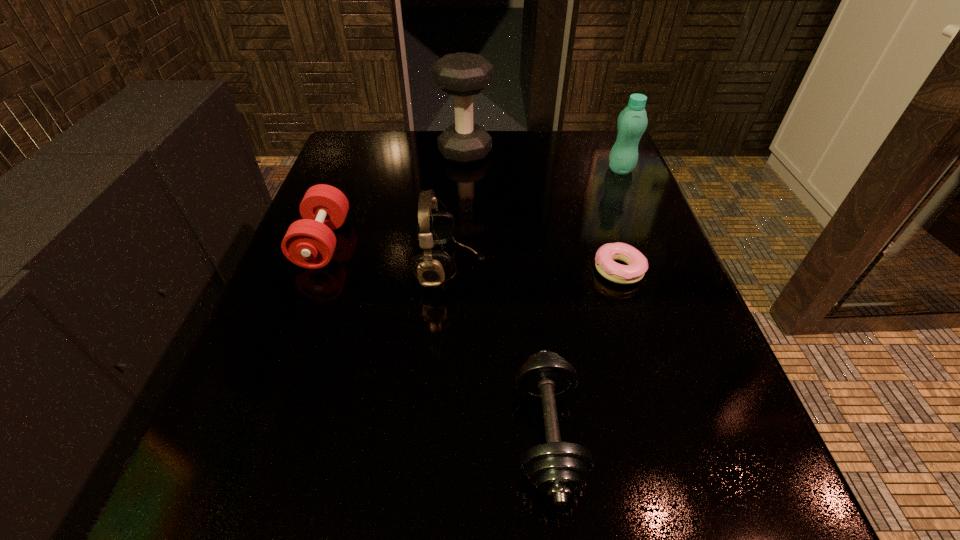
Identify the location of unoccupied area between the farthest dumbbell and the headset. This screenshot has width=960, height=540. (458, 210).

Identify the location of free space that is in between the leftmost dumbbell and the headset. (387, 255).

Find the location of a particular element. vacant point located between the fifth object from left to right and the tallest dumbbell is located at coordinates (541, 211).

I want to click on empty location between the nearest dumbbell and the shortest object, so click(x=583, y=352).

You are a GUI agent. You are given a task and a screenshot of the screen. Output one action in this format:
    pyautogui.click(x=<x>, y=<y>)
    Task: Click on the unoccupied area between the second dumbbell from right to left and the shortest object
    Image resolution: width=960 pixels, height=540 pixels.
    Given the screenshot: What is the action you would take?
    pyautogui.click(x=541, y=211)

Find the location of a particular element. The image size is (960, 540). free space between the second dumbbell from left to right and the rightmost object is located at coordinates (542, 161).

The height and width of the screenshot is (540, 960). I want to click on vacant area that lies between the second dumbbell from left to right and the headset, so click(458, 210).

This screenshot has width=960, height=540. I want to click on vacant area that lies between the rightmost dumbbell and the leftmost object, so click(x=435, y=338).

Find the location of a particular element. This screenshot has height=540, width=960. vacant space in between the bottle and the leftmost object is located at coordinates (471, 206).

Where is `object identified as the second closest to the bottle`? object identified as the second closest to the bottle is located at coordinates (463, 75).